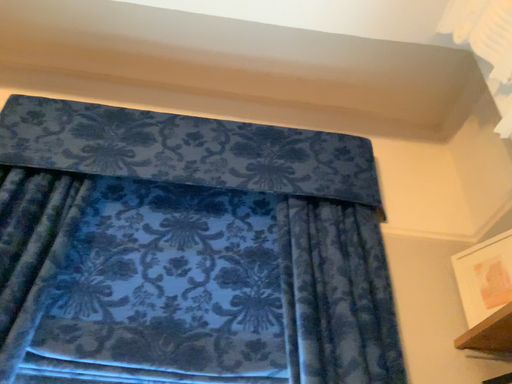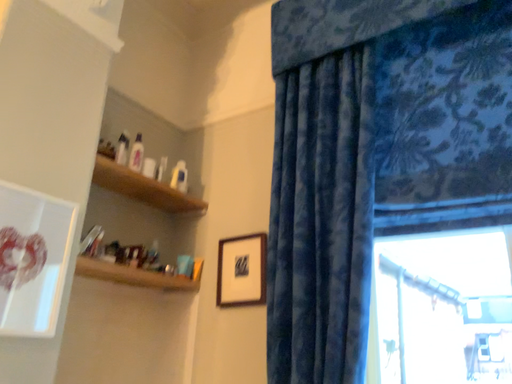
Question: How did the camera likely rotate when shooting the video?

Choices:
 (A) rotated right
 (B) rotated left

Answer: (B)